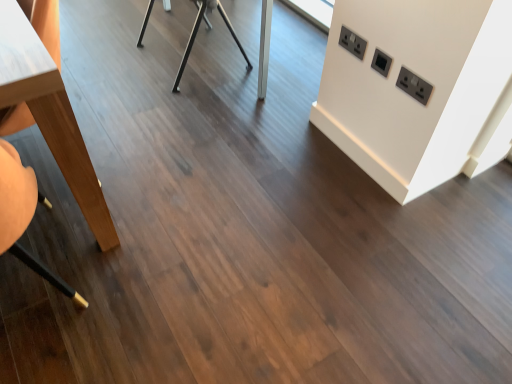
This screenshot has height=384, width=512. Identify the location of unoccupied space behind light brown wood table at left, the 2th table viewed from the back. [117, 100].